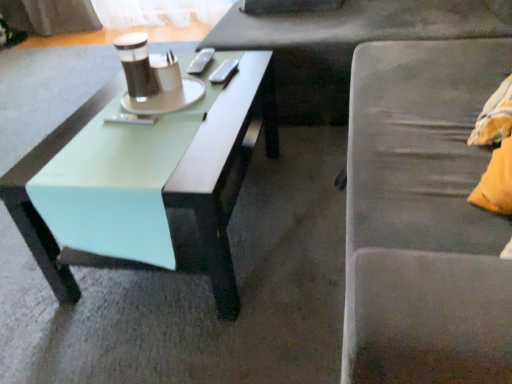
Locate an element on the screen. vacant area that is in front of matte black remote control at center, marked as the third remote control in a top-to-bottom arrangement is located at coordinates (121, 147).